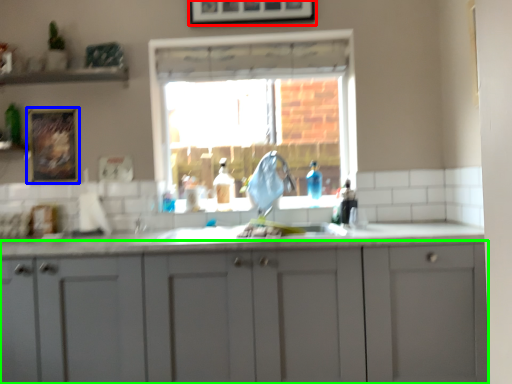
Question: Which is nearer to the picture frame (highlighted by a red box)? picture frame (highlighted by a blue box) or cabinetry (highlighted by a green box).

Choices:
 (A) picture frame
 (B) cabinetry

Answer: (A)